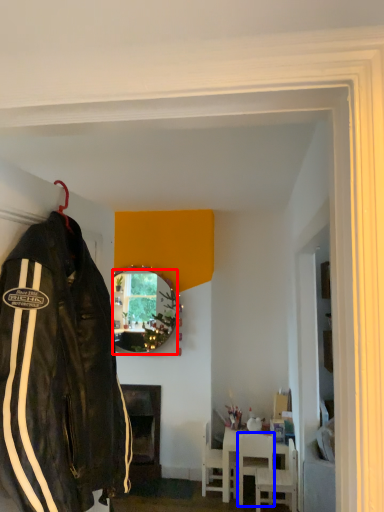
Question: Which of the following is the closest to the observer, mirror (highlighted by a red box) or chair (highlighted by a blue box)?

Choices:
 (A) mirror
 (B) chair

Answer: (B)